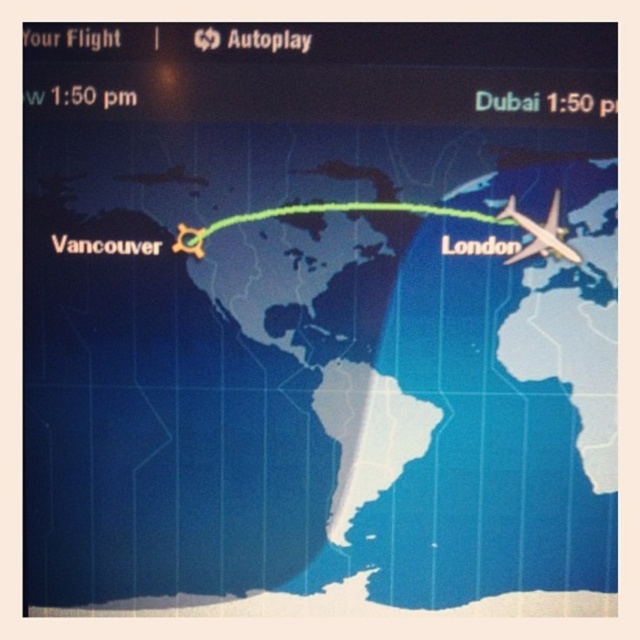
Consider the image. You are standing 5 feet away from the map displayed on a screen. You notice a point marked at coordinate point (x=163, y=577). If you want to touch this point on the screen, will you need to lean forward or backward?

The distance of point (x=163, y=577) from viewer is 4.75 feet, so you are currently 5 feet away from it. To reach the point, you need to lean forward 0.25 feet closer to the screen.

You are using a flight tracking app and see the green line at center and the metallic silver airplane at right on the map. Which object takes up more space on the screen?

The green line at center is larger in size than the metallic silver airplane at right, so the green line at center takes up more space on the screen.

You are using a flight tracking app and see the map showing the flight path from Vancouver to London. The app indicates a point at coordinates (320, 212). Where is this point located relative to the green line representing the flight path?

The point at coordinates (320, 212) marks the green line at center, so it is located exactly at the center of the flight path.